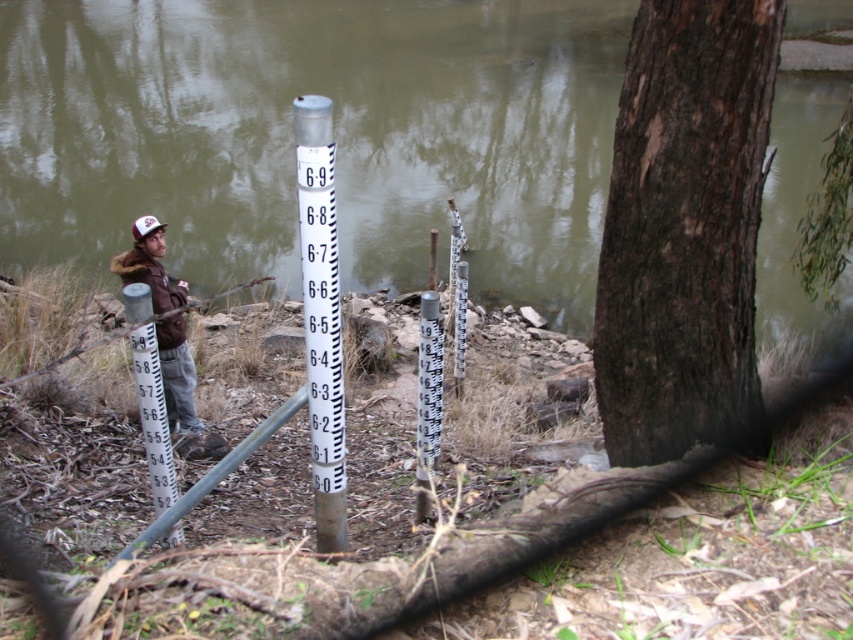
Question: Which object appears farthest from the camera in this image?

Choices:
 (A) white plastic pole at left
 (B) white plastic pole at center
 (C) brown fuzzy jacket at left

Answer: (C)

Question: Can you confirm if dark brown bark at center right is positioned to the right of white plastic pole at left?

Choices:
 (A) no
 (B) yes

Answer: (B)

Question: In this image, where is dark brown bark at center right located relative to white plastic pole at left?

Choices:
 (A) right
 (B) left

Answer: (A)

Question: Which point is closer to the camera?

Choices:
 (A) dark brown bark at center right
 (B) brown fuzzy jacket at left

Answer: (A)

Question: Among these points, which one is farthest from the camera?

Choices:
 (A) (235, 208)
 (B) (660, 51)
 (C) (431, 390)
 (D) (158, 468)

Answer: (A)

Question: Does dark brown bark at center right have a smaller size compared to brown fuzzy jacket at left?

Choices:
 (A) no
 (B) yes

Answer: (A)